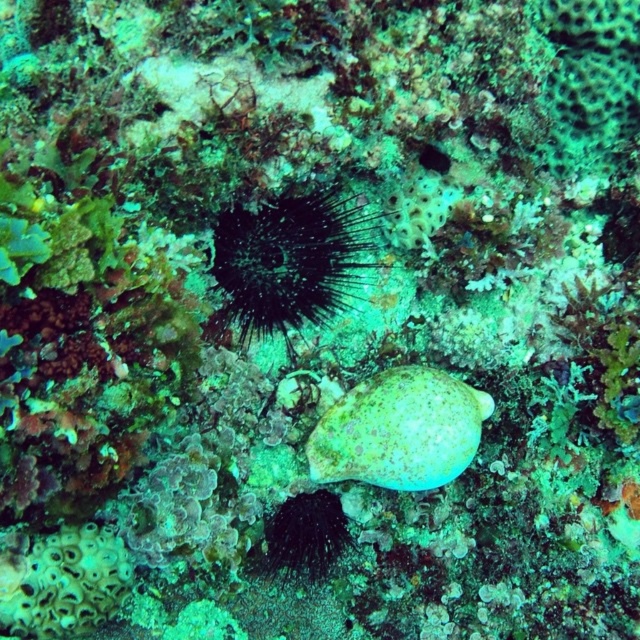
Question: Which object is closer to the camera taking this photo?

Choices:
 (A) speckled green shell at center
 (B) dark spiny sea urchin at center

Answer: (A)

Question: Which of the following is the farthest from the observer?

Choices:
 (A) speckled green shell at center
 (B) dark spiny sea urchin at center

Answer: (B)

Question: Does dark spiny sea urchin at center appear on the right side of speckled green shell at center?

Choices:
 (A) yes
 (B) no

Answer: (B)

Question: Observing the image, what is the correct spatial positioning of dark spiny sea urchin at center in reference to speckled green shell at center?

Choices:
 (A) above
 (B) below

Answer: (A)

Question: Which point is farther to the camera?

Choices:
 (A) (353, 417)
 (B) (346, 208)

Answer: (B)

Question: Does dark spiny sea urchin at center come in front of speckled green shell at center?

Choices:
 (A) yes
 (B) no

Answer: (B)